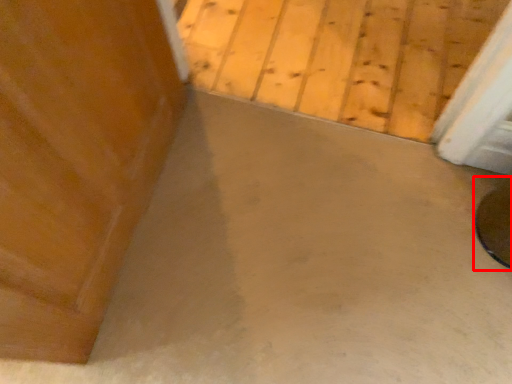
Question: Considering the relative positions of round table (annotated by the red box) and concrete in the image provided, where is round table (annotated by the red box) located with respect to the staircase?

Choices:
 (A) left
 (B) right

Answer: (B)